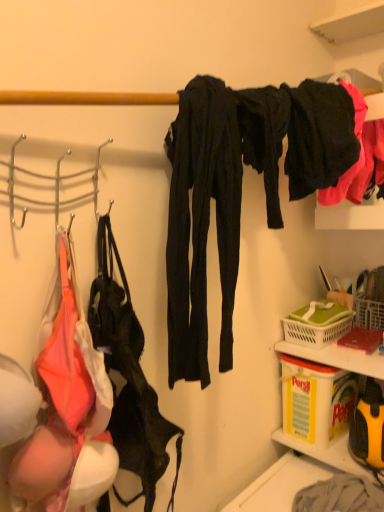
Question: Based on their positions, is black matte pants at upper right, the second clothing from the left, located to the left or right of yellow plastic container at lower right?

Choices:
 (A) left
 (B) right

Answer: (A)

Question: Which is correct: black matte pants at upper right, the second clothing from the left, is inside yellow plastic container at lower right, or outside of it?

Choices:
 (A) outside
 (B) inside

Answer: (A)

Question: Which is nearer to the yellow plastic container at lower right?

Choices:
 (A) leather-like black handbag at left
 (B) green plastic basket at lower right
 (C) black matte pants at upper right, the second clothing from the left
 (D) matte black pants at center, acting as the 2th clothing starting from the right

Answer: (B)

Question: Based on their relative distances, which object is nearer to the green plastic basket at lower right?

Choices:
 (A) matte black pants at center, which is counted as the 1th clothing, starting from the left
 (B) black matte pants at upper right, the first clothing from the right
 (C) leather-like black handbag at left
 (D) yellow plastic container at lower right

Answer: (D)